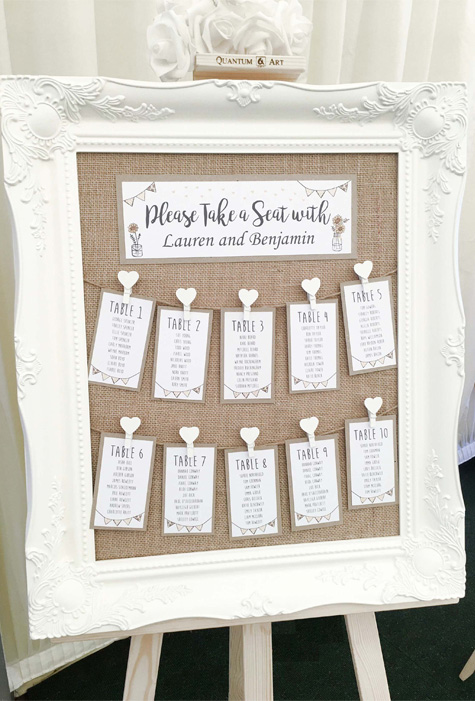
The width and height of the screenshot is (475, 701). Identify the location of picture frame. (432, 519), (35, 359), (263, 584), (250, 111).